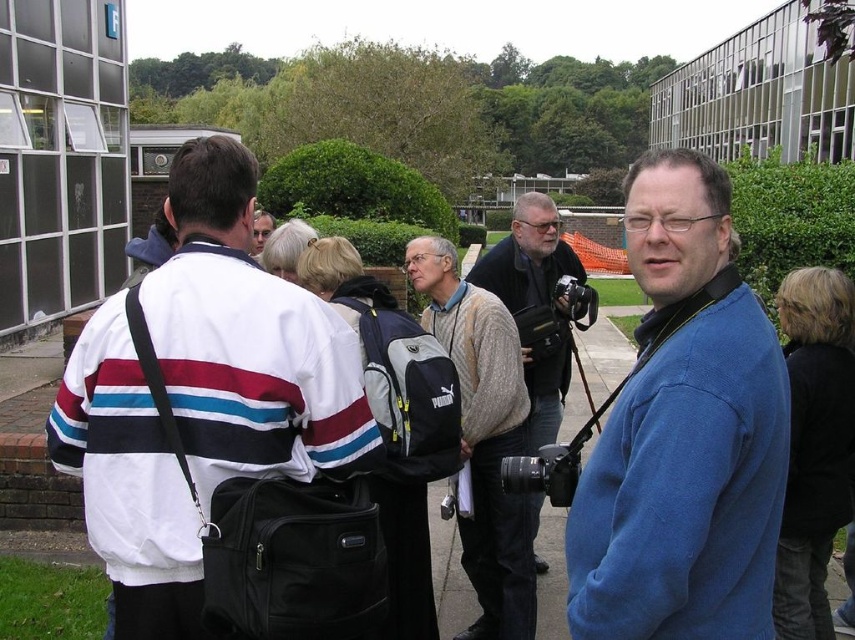
Question: Which object is the closest to the matte black camera at center?

Choices:
 (A) matte black backpack at center
 (B) white striped jacket at upper left
 (C) blue fleece jacket at right

Answer: (A)

Question: Which point is closer to the camera?

Choices:
 (A) knitted sweater at center
 (B) white striped jacket at upper left
 (C) matte black backpack at center
 (D) blue fleece jacket at right

Answer: (D)

Question: Can you confirm if white striped jacket at upper left is wider than matte black camera at center?

Choices:
 (A) yes
 (B) no

Answer: (A)

Question: Does knitted sweater at center have a smaller size compared to matte black camera at center?

Choices:
 (A) yes
 (B) no

Answer: (A)

Question: Based on their relative distances, which object is nearer to the blue fleece jacket at right?

Choices:
 (A) matte black camera at center
 (B) matte black backpack at center
 (C) knitted sweater at center

Answer: (C)

Question: Is the position of white striped jacket at upper left more distant than that of matte black camera at center?

Choices:
 (A) yes
 (B) no

Answer: (B)